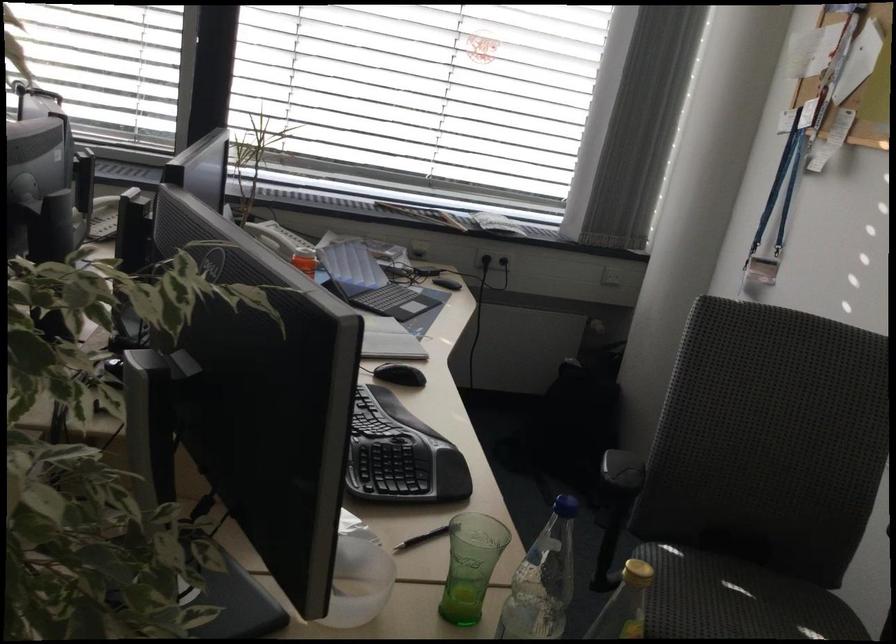
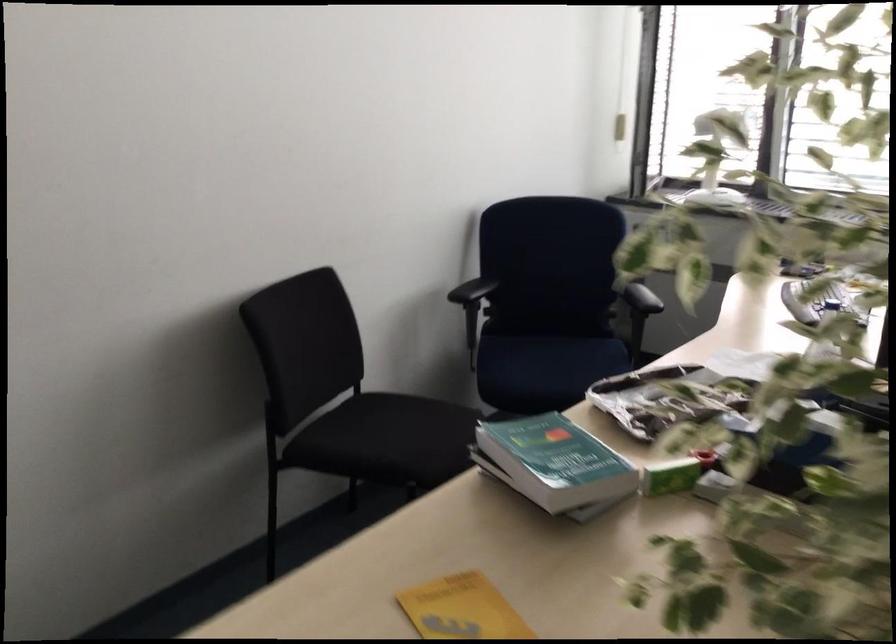
Question: The images are taken continuously from a first-person perspective. In which direction is your viewpoint rotating?

Choices:
 (A) Left
 (B) Right
 (C) Up
 (D) Down

Answer: (A)